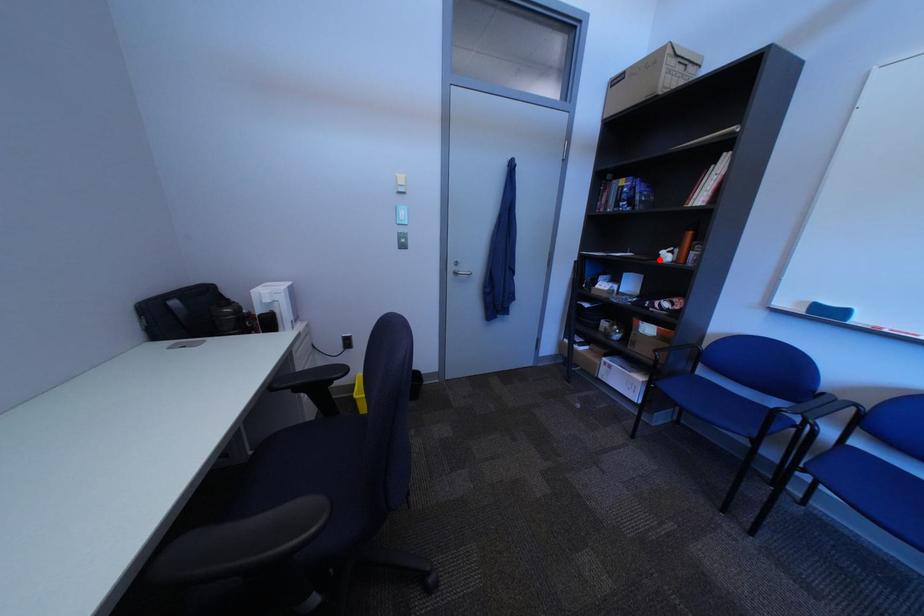
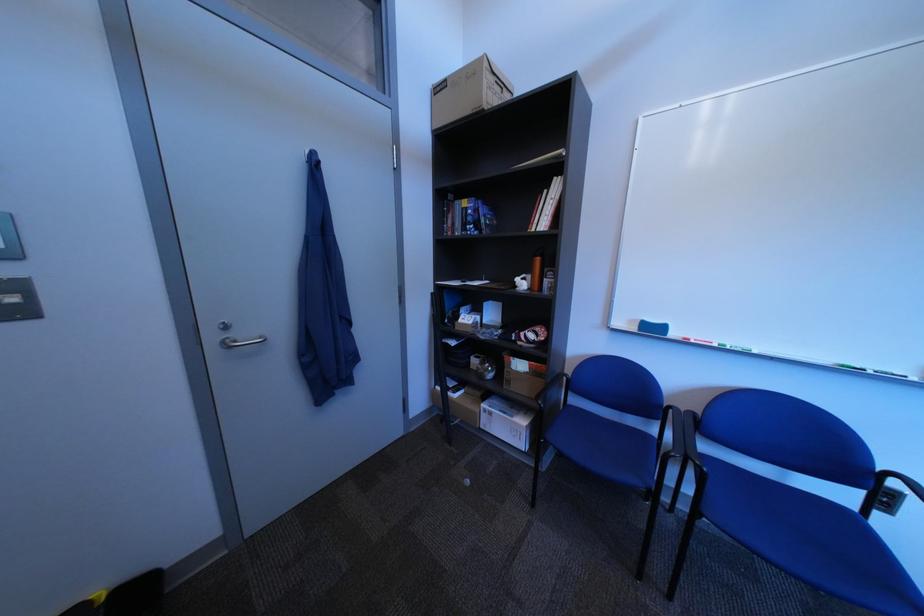
In the second image, find the point that corresponds to the highlighted location in the first image.

(517, 290)